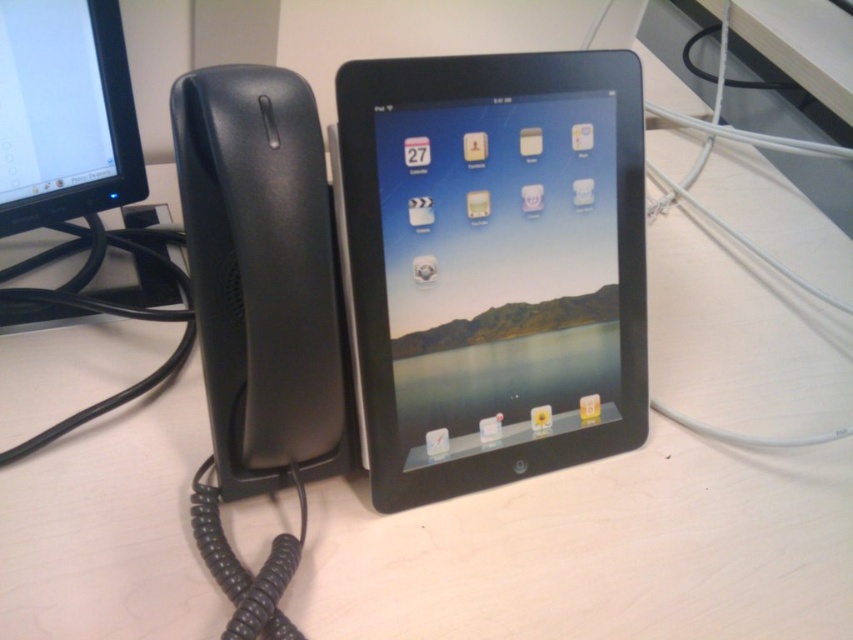
You need to place a new keyboard that is 12 inches wide on the desk. Given the black glossy tablet at center and the matte black monitor at upper left, which object should you place the keyboard next to to ensure it fits without overlapping?

The black glossy tablet at center is wider than the matte black monitor at upper left. Therefore, placing the keyboard next to the matte black monitor at upper left would provide enough space since the tablet requires more width.

You are organizing the desk and want to place a new document holder. The document holder requires 12 inches of space. Given the sizes of the black glossy tablet at center and the matte black monitor at upper left, which device can accommodate the document holder next to it without overlapping?

The black glossy tablet at center has a larger size compared to the matte black monitor at upper left, so it can accommodate the document holder next to it without overlapping.